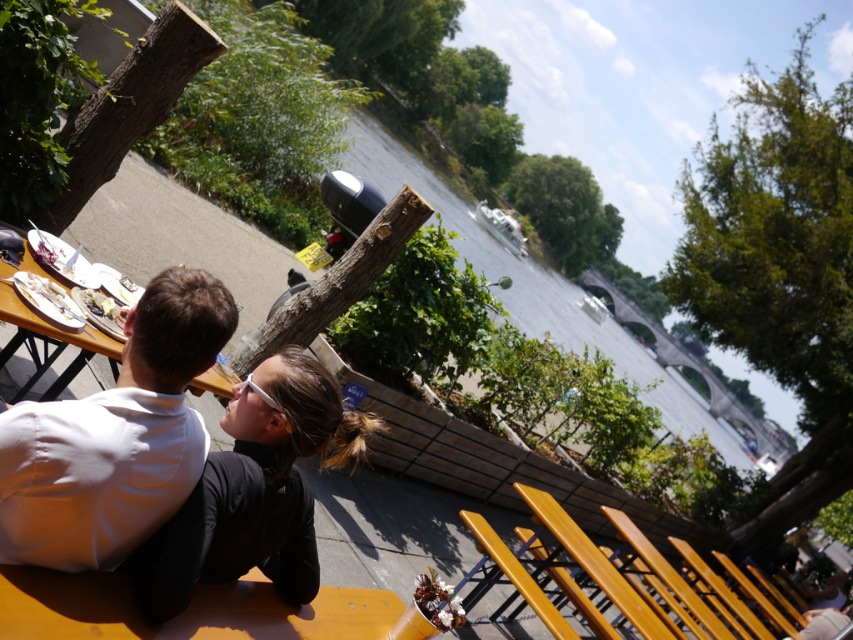
Can you confirm if black matte jacket at center is bigger than wooden bench at lower center?

No.

Is black matte jacket at center wider than wooden bench at lower center?

No.

This screenshot has height=640, width=853. I want to click on black matte jacket at center, so click(254, 490).

Image resolution: width=853 pixels, height=640 pixels. Identify the location of black matte jacket at center. (254, 490).

Does black matte jacket at center appear over wooden picnic table at lower left?

No.

Between black matte jacket at center and wooden picnic table at lower left, which one is positioned higher?

wooden picnic table at lower left is above.

Measure the distance between black matte jacket at center and camera.

black matte jacket at center is 8.07 feet from camera.

At what (x,y) coordinates should I click in order to perform the action: click on black matte jacket at center. Please return your answer as a coordinate pair (x, y). Looking at the image, I should click on (254, 490).

Does point (196, 362) lie in front of point (18, 326)?

Yes, point (196, 362) is closer to viewer.

Does white matte shirt at upper left appear on the left side of wooden picnic table at lower left?

Incorrect, white matte shirt at upper left is not on the left side of wooden picnic table at lower left.

Is point (62, 417) farther from viewer compared to point (70, 337)?

No, it is in front of (70, 337).

Identify the location of white matte shirt at upper left. The width and height of the screenshot is (853, 640). (115, 436).